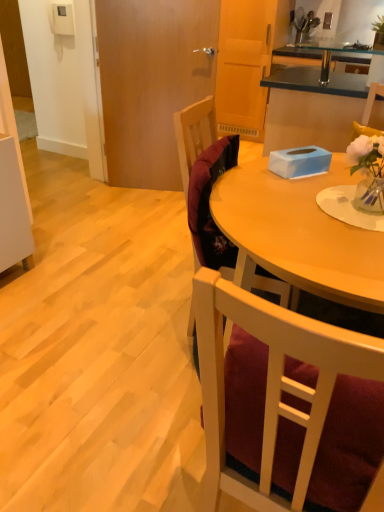
Question: Considering the positions of blue matte tissue box at center and velvet burgundy chair at center, which ranks as the 1th chair in back-to-front order, in the image, is blue matte tissue box at center taller or shorter than velvet burgundy chair at center, which ranks as the 1th chair in back-to-front order,?

Choices:
 (A) short
 (B) tall

Answer: (A)

Question: Is blue matte tissue box at center spatially inside velvet burgundy chair at center, the 2th chair when ordered from front to back, or outside of it?

Choices:
 (A) outside
 (B) inside

Answer: (A)

Question: Estimate the real-world distances between objects in this image. Which object is farther from the velvet burgundy chair at center, the second chair viewed from the back?

Choices:
 (A) velvet burgundy chair at center, the 2th chair when ordered from front to back
 (B) blue matte tissue box at center

Answer: (B)

Question: Estimate the real-world distances between objects in this image. Which object is closer to the blue matte tissue box at center?

Choices:
 (A) velvet burgundy chair at center, the second chair viewed from the back
 (B) velvet burgundy chair at center, the 2th chair when ordered from front to back

Answer: (B)